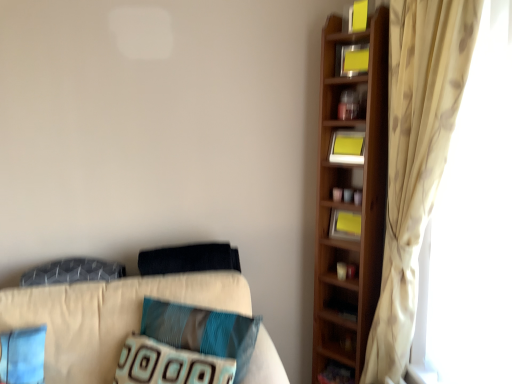
What do you see at coordinates (73, 272) in the screenshot?
I see `textured gray pillow at left, positioned as the third pillow in bottom-to-top order` at bounding box center [73, 272].

At what (x,y) coordinates should I click in order to perform the action: click on wooden cabinet at upper right, placed as the 2th cabinet when sorted from bottom to top. Please return your answer as a coordinate pair (x, y). Looking at the image, I should click on (352, 103).

The image size is (512, 384). What do you see at coordinates (188, 259) in the screenshot?
I see `dark blue fabric pillow at center, the fourth pillow in the bottom-to-top sequence` at bounding box center [188, 259].

What is the approximate height of textured blue pillow at center, the first pillow from the bottom?

textured blue pillow at center, the first pillow from the bottom, is 23.52 centimeters in height.

Where is `textured blue pillow at center, the first pillow from the bottom`? The image size is (512, 384). textured blue pillow at center, the first pillow from the bottom is located at coordinates point(169,364).

You are a GUI agent. You are given a task and a screenshot of the screen. Output one action in this format:
    pyautogui.click(x=<x>, y=<y>)
    Task: Click on the beige floral curtain at right
    The width and height of the screenshot is (512, 384).
    Given the screenshot: What is the action you would take?
    click(416, 157)

What do you see at coordinates (336, 374) in the screenshot?
I see `wooden cabinet at lower right, arranged as the 1th cabinet when ordered from the bottom` at bounding box center [336, 374].

What are the coordinates of `textured gray pillow at left, positioned as the third pillow in bottom-to-top order` in the screenshot? It's located at (73, 272).

Which object is further away from the camera taking this photo, wooden cabinet at upper right, which ranks as the 1th cabinet in top-to-bottom order, or textured gray pillow at left, the second pillow positioned from the top?

wooden cabinet at upper right, which ranks as the 1th cabinet in top-to-bottom order, is more distant.

Between wooden cabinet at upper right, placed as the 1th cabinet when sorted from front to back, and textured gray pillow at left, the second pillow positioned from the top, which one appears on the right side from the viewer's perspective?

From the viewer's perspective, wooden cabinet at upper right, placed as the 1th cabinet when sorted from front to back, appears more on the right side.

Is teal fabric pillow at center, the second pillow from the bottom, positioned with its back to yellow matte bookshelf at upper right, which is the 3th book in bottom-to-top order?

No, teal fabric pillow at center, the second pillow from the bottom, is not facing the opposite direction of yellow matte bookshelf at upper right, which is the 3th book in bottom-to-top order.

Which is more to the right, teal fabric pillow at center, which is the third pillow in top-to-bottom order, or yellow matte bookshelf at upper right, which is the 3th book in bottom-to-top order?

From the viewer's perspective, yellow matte bookshelf at upper right, which is the 3th book in bottom-to-top order, appears more on the right side.

How many degrees apart are the facing directions of teal fabric pillow at center, which is the third pillow in top-to-bottom order, and yellow matte bookshelf at upper right, the second book when ordered from top to bottom?

The facing directions of teal fabric pillow at center, which is the third pillow in top-to-bottom order, and yellow matte bookshelf at upper right, the second book when ordered from top to bottom, are 29.6 degrees apart.

Would you say teal fabric pillow at center, the second pillow from the bottom, is outside yellow matte bookshelf at upper right, the second book when ordered from top to bottom?

Yes.

From the picture: How different are the orientations of wooden cabinet at lower right, arranged as the 1th cabinet when ordered from the bottom, and yellow matte bookshelf at upper right, the second book when ordered from top to bottom, in degrees?

The angle between the facing direction of wooden cabinet at lower right, arranged as the 1th cabinet when ordered from the bottom, and the facing direction of yellow matte bookshelf at upper right, the second book when ordered from top to bottom, is 15.5 degrees.

Considering the relative sizes of wooden cabinet at lower right, which is the first cabinet in back-to-front order, and yellow matte bookshelf at upper right, which is the 3th book in bottom-to-top order, in the image provided, is wooden cabinet at lower right, which is the first cabinet in back-to-front order, bigger than yellow matte bookshelf at upper right, which is the 3th book in bottom-to-top order,?

Yes.

Which object is positioned more to the left, wooden cabinet at lower right, positioned as the 2th cabinet in top-to-bottom order, or yellow matte bookshelf at upper right, which is the 3th book in bottom-to-top order?

From the viewer's perspective, wooden cabinet at lower right, positioned as the 2th cabinet in top-to-bottom order, appears more on the left side.

From a real-world perspective, which is physically below, wooden cabinet at lower right, which is the first cabinet in back-to-front order, or yellow matte bookshelf at upper right, the second book when ordered from top to bottom?

In real-world perspective, wooden cabinet at lower right, which is the first cabinet in back-to-front order, is lower.

Considering the relative positions of wooden cabinet at lower right, which is the 2th cabinet in front-to-back order, and textured blue pillow at center, the first pillow from the bottom, in the image provided, is wooden cabinet at lower right, which is the 2th cabinet in front-to-back order, in front of textured blue pillow at center, the first pillow from the bottom,?

No, it is not.

Considering the relative sizes of wooden cabinet at lower right, which is the 2th cabinet in front-to-back order, and textured blue pillow at center, the first pillow from the bottom, in the image provided, is wooden cabinet at lower right, which is the 2th cabinet in front-to-back order, thinner than textured blue pillow at center, the first pillow from the bottom,?

Yes.

From the image's perspective, which object appears higher, wooden cabinet at lower right, arranged as the 1th cabinet when ordered from the bottom, or textured blue pillow at center, the first pillow from the bottom?

textured blue pillow at center, the first pillow from the bottom.

Locate an element on the screen. The width and height of the screenshot is (512, 384). cabinet below the textured blue pillow at center, the first pillow from the bottom (from a real-world perspective) is located at coordinates (336, 374).

Is wooden cabinet at lower right, which is the first cabinet in back-to-front order, not near beige floral curtain at right?

wooden cabinet at lower right, which is the first cabinet in back-to-front order, is actually quite close to beige floral curtain at right.

Can you tell me how much wooden cabinet at lower right, arranged as the 1th cabinet when ordered from the bottom, and beige floral curtain at right differ in facing direction?

42.1 degrees separate the facing orientations of wooden cabinet at lower right, arranged as the 1th cabinet when ordered from the bottom, and beige floral curtain at right.

How far apart are wooden cabinet at lower right, arranged as the 1th cabinet when ordered from the bottom, and beige floral curtain at right?

wooden cabinet at lower right, arranged as the 1th cabinet when ordered from the bottom, is 84.08 centimeters from beige floral curtain at right.

Find the location of a particular element. Image resolution: width=512 pixels, height=384 pixels. cabinet that is below the beige floral curtain at right (from the image's perspective) is located at coordinates (336, 374).

Is yellow paper at upper right, the 3th book in the top-to-bottom sequence, taller or shorter than wooden cabinet at upper right, which ranks as the 1th cabinet in top-to-bottom order?

Considering their sizes, yellow paper at upper right, the 3th book in the top-to-bottom sequence, has less height than wooden cabinet at upper right, which ranks as the 1th cabinet in top-to-bottom order.

Find the location of a particular element. Image resolution: width=512 pixels, height=384 pixels. cabinet located in front of the yellow paper at upper right, the 3th book in the top-to-bottom sequence is located at coordinates (352, 103).

Considering their positions, is yellow paper at upper right, the second book ordered from the bottom, located in front of or behind wooden cabinet at upper right, placed as the 2th cabinet when sorted from bottom to top?

yellow paper at upper right, the second book ordered from the bottom, is behind wooden cabinet at upper right, placed as the 2th cabinet when sorted from bottom to top.

Does point (360, 139) come farther from viewer compared to point (343, 119)?

Yes, it is behind point (343, 119).

Is textured gray pillow at left, the second pillow positioned from the top, spatially inside textured blue pillow at center, acting as the 4th pillow starting from the top, or outside of it?

textured gray pillow at left, the second pillow positioned from the top, is located beyond the bounds of textured blue pillow at center, acting as the 4th pillow starting from the top.

Consider the image. From the image's perspective, is textured gray pillow at left, the second pillow positioned from the top, located above or below textured blue pillow at center, acting as the 4th pillow starting from the top?

Based on their image positions, textured gray pillow at left, the second pillow positioned from the top, is located above textured blue pillow at center, acting as the 4th pillow starting from the top.

Considering the sizes of textured gray pillow at left, positioned as the third pillow in bottom-to-top order, and textured blue pillow at center, acting as the 4th pillow starting from the top, in the image, is textured gray pillow at left, positioned as the third pillow in bottom-to-top order, bigger or smaller than textured blue pillow at center, acting as the 4th pillow starting from the top,?

textured gray pillow at left, positioned as the third pillow in bottom-to-top order, is smaller than textured blue pillow at center, acting as the 4th pillow starting from the top.

From a real-world perspective, between textured gray pillow at left, the second pillow positioned from the top, and textured blue pillow at center, acting as the 4th pillow starting from the top, who is vertically lower?

textured blue pillow at center, acting as the 4th pillow starting from the top.

This screenshot has width=512, height=384. I want to click on cabinet above the textured gray pillow at left, the second pillow positioned from the top (from a real-world perspective), so click(x=352, y=103).

This screenshot has width=512, height=384. In order to click on the 2nd pillow in front of the yellow matte bookshelf at upper right, which is the 3th book in bottom-to-top order in this screenshot , I will do `click(202, 331)`.

When comparing their distances from yellow paper at upper right, which ranks as the fourth book in top-to-bottom order, does teal fabric pillow at center, the second pillow from the bottom, or dark blue fabric pillow at center, the fourth pillow in the bottom-to-top sequence, seem further?

The object further to yellow paper at upper right, which ranks as the fourth book in top-to-bottom order, is teal fabric pillow at center, the second pillow from the bottom.

Based on their spatial positions, is teal fabric pillow at center, which is the third pillow in top-to-bottom order, or yellow paper at upper right, positioned as the 1th book in bottom-to-top order, closer to yellow matte bookshelf at upper right, which is the 3th book in bottom-to-top order?

yellow paper at upper right, positioned as the 1th book in bottom-to-top order, is closer to yellow matte bookshelf at upper right, which is the 3th book in bottom-to-top order.

Based on their spatial positions, is yellow paper at upper right, positioned as the 1th book in bottom-to-top order, or wooden cabinet at upper right, which ranks as the 1th cabinet in top-to-bottom order, further from wooden cabinet at lower right, arranged as the 1th cabinet when ordered from the bottom?

wooden cabinet at upper right, which ranks as the 1th cabinet in top-to-bottom order.

Estimate the real-world distances between objects in this image. Which object is further from wooden cabinet at lower right, which is the 2th cabinet in front-to-back order, teal fabric pillow at center, which is the third pillow in top-to-bottom order, or dark blue fabric pillow at center, which is the first pillow from top to bottom?

The object further to wooden cabinet at lower right, which is the 2th cabinet in front-to-back order, is dark blue fabric pillow at center, which is the first pillow from top to bottom.

Estimate the real-world distances between objects in this image. Which object is further from wooden cabinet at lower right, which is the first cabinet in back-to-front order, yellow paper at upper right, the 1th book positioned from the top, or yellow paper at upper right, the second book ordered from the bottom?

yellow paper at upper right, the 1th book positioned from the top.

From the image, which object appears to be nearer to teal fabric pillow at center, which is the third pillow in top-to-bottom order, yellow paper at upper right, which ranks as the fourth book in top-to-bottom order, or yellow matte bookshelf at upper right, the second book when ordered from top to bottom?

Among the two, yellow paper at upper right, which ranks as the fourth book in top-to-bottom order, is located nearer to teal fabric pillow at center, which is the third pillow in top-to-bottom order.

Considering their positions, is wooden cabinet at upper right, placed as the 2th cabinet when sorted from bottom to top, positioned further to beige floral curtain at right than textured blue pillow at center, acting as the 4th pillow starting from the top?

textured blue pillow at center, acting as the 4th pillow starting from the top, is further to beige floral curtain at right.

From the image, which object appears to be nearer to dark blue fabric pillow at center, which is the first pillow from top to bottom, yellow paper at upper right, the 3th book in the top-to-bottom sequence, or yellow paper at upper right, the 1th book positioned from the top?

The object closer to dark blue fabric pillow at center, which is the first pillow from top to bottom, is yellow paper at upper right, the 3th book in the top-to-bottom sequence.

Where is `book between yellow paper at upper right, the second book ordered from the bottom, and teal fabric pillow at center, the second pillow from the bottom, in the vertical direction`? book between yellow paper at upper right, the second book ordered from the bottom, and teal fabric pillow at center, the second pillow from the bottom, in the vertical direction is located at coordinates (345, 225).

Where is `cabinet that lies between yellow paper at upper right, which appears as the fourth book when ordered from the bottom, and yellow paper at upper right, which ranks as the fourth book in top-to-bottom order, from top to bottom`? The height and width of the screenshot is (384, 512). cabinet that lies between yellow paper at upper right, which appears as the fourth book when ordered from the bottom, and yellow paper at upper right, which ranks as the fourth book in top-to-bottom order, from top to bottom is located at coordinates (352, 103).

In order to click on cabinet between yellow matte bookshelf at upper right, the second book when ordered from top to bottom, and textured blue pillow at center, the first pillow from the bottom, in the up-down direction in this screenshot , I will do `click(352, 103)`.

Locate an element on the screen. The width and height of the screenshot is (512, 384). curtain between yellow paper at upper right, which appears as the fourth book when ordered from the bottom, and yellow paper at upper right, positioned as the 1th book in bottom-to-top order, from top to bottom is located at coordinates (416, 157).